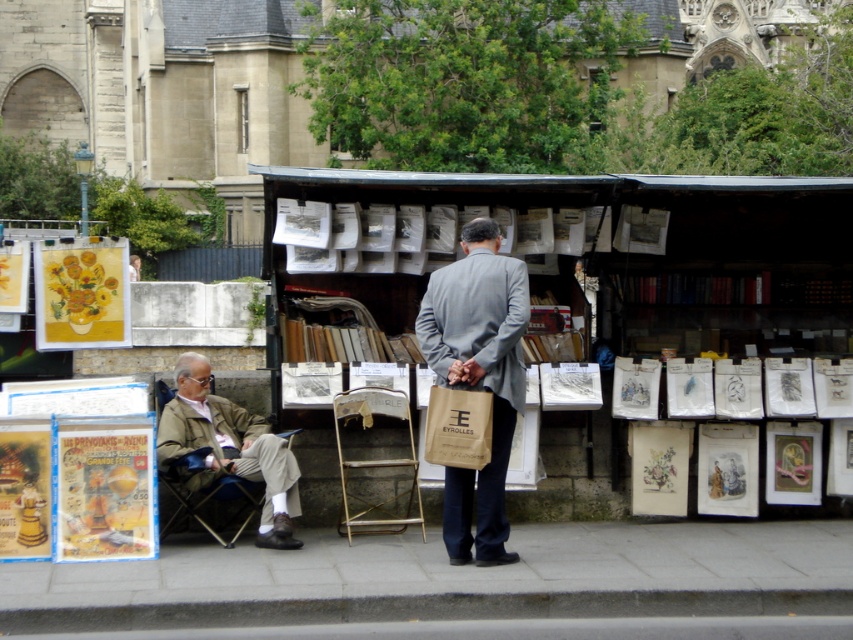
Question: Among these objects, which one is farthest from the camera?

Choices:
 (A) khaki fabric jacket at left
 (B) metallic gold folding chair at center
 (C) gray fabric suit at center

Answer: (B)

Question: Which object is positioned closest to the khaki fabric jacket at left?

Choices:
 (A) gray fabric suit at center
 (B) gray concrete pavement at lower center

Answer: (A)

Question: Is gray concrete pavement at lower center closer to camera compared to gray fabric suit at center?

Choices:
 (A) yes
 (B) no

Answer: (A)

Question: Is gray fabric suit at center smaller than khaki fabric jacket at left?

Choices:
 (A) yes
 (B) no

Answer: (A)

Question: Does gray concrete pavement at lower center appear over gray fabric suit at center?

Choices:
 (A) no
 (B) yes

Answer: (A)

Question: Among these points, which one is farthest from the camera?

Choices:
 (A) (213, 477)
 (B) (363, 410)
 (C) (444, 298)

Answer: (B)